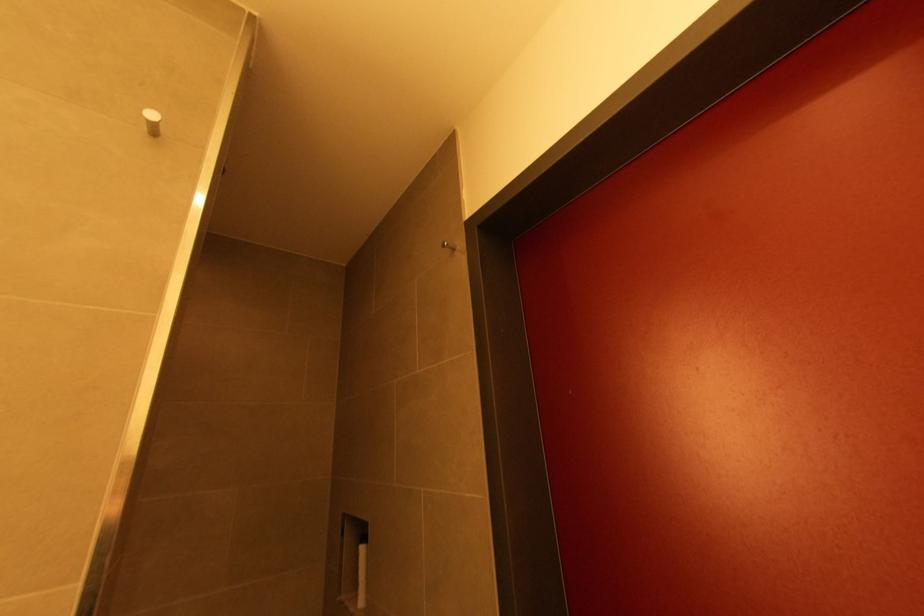
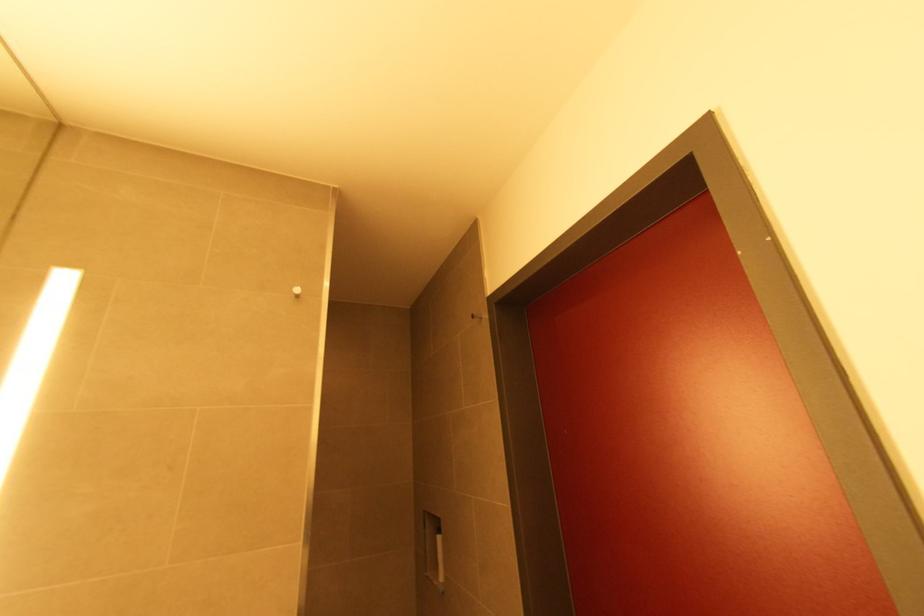
The images are taken continuously from a first-person perspective. In which direction are you moving?

The movement direction of the cameraman is right, backward.